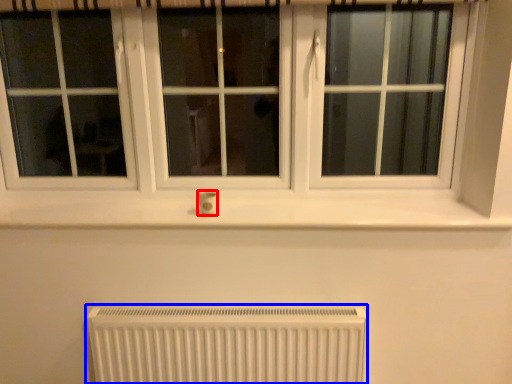
Question: Which of the following is the closest to the observer, electric outlet (highlighted by a red box) or radiator (highlighted by a blue box)?

Choices:
 (A) electric outlet
 (B) radiator

Answer: (B)